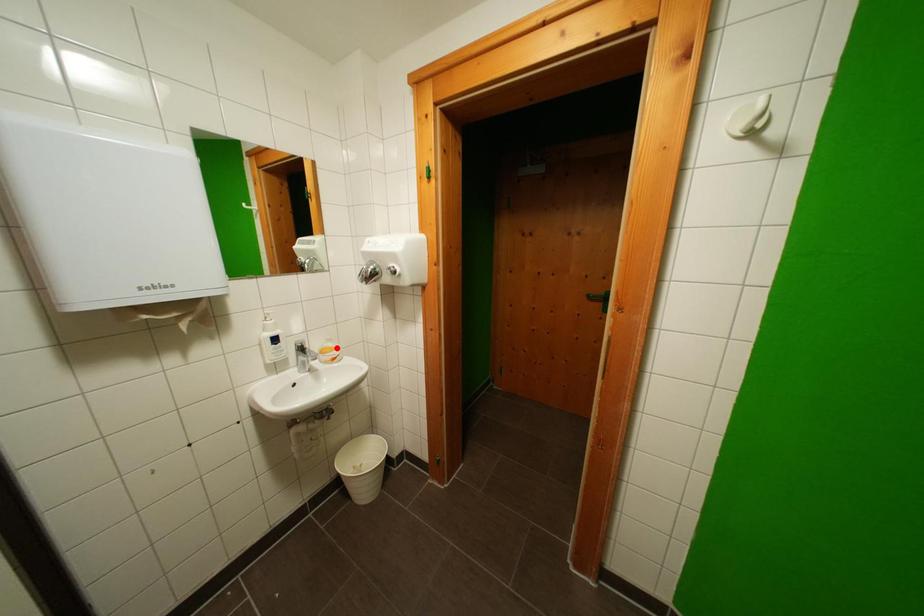
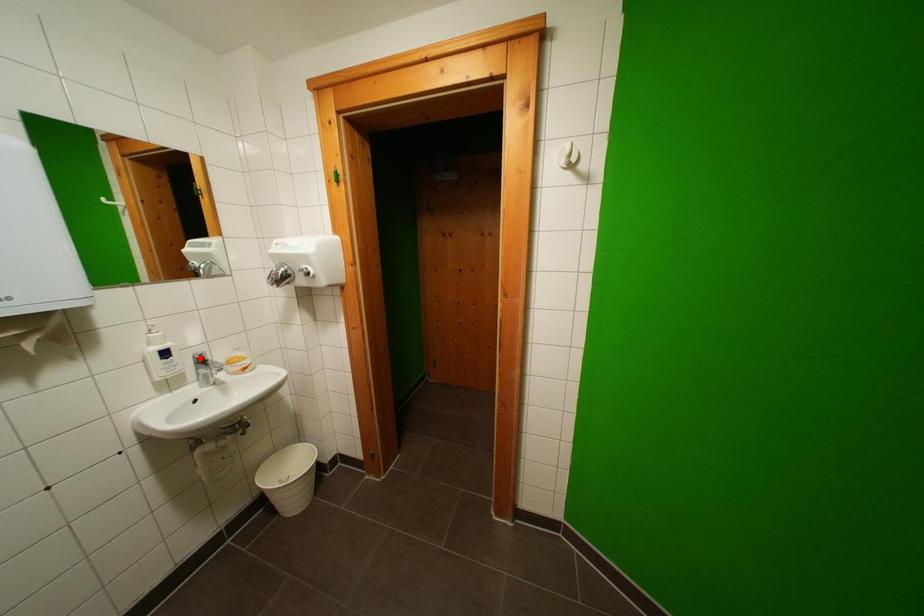
I am providing you with two images of the same scene from different viewpoints. A red point is marked on the first image and another point is marked on the second image. Do the highlighted points in image1 and image2 indicate the same real-world spot?

No